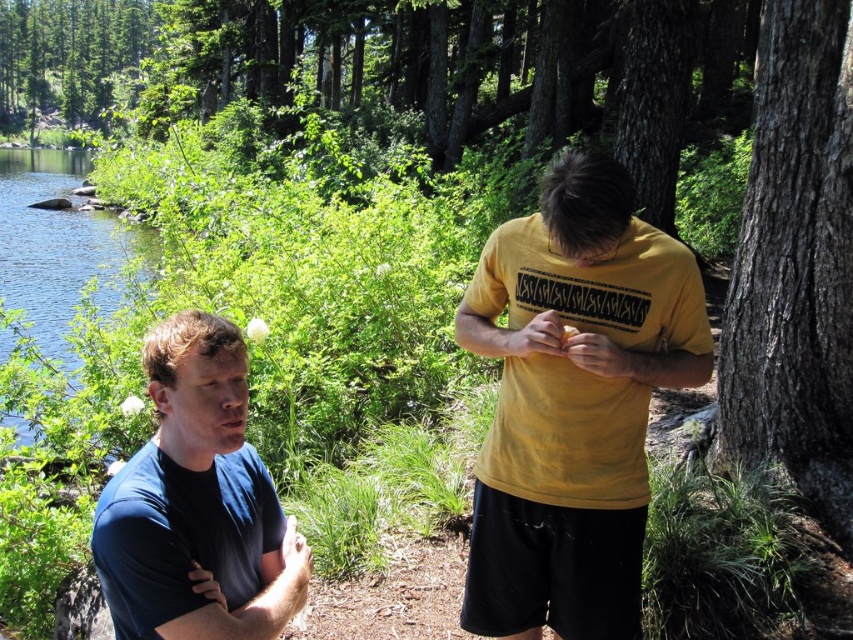
Between yellow matte shirt at right and smooth bark tree at right, which one is positioned lower?

yellow matte shirt at right is below.

Who is more distant from viewer, (552, 204) or (808, 298)?

Point (808, 298)

This screenshot has height=640, width=853. What are the coordinates of `yellow matte shirt at right` in the screenshot? It's located at [x=573, y=403].

Locate an element on the screen. This screenshot has height=640, width=853. yellow matte shirt at right is located at coordinates (573, 403).

Can you confirm if yellow matte shirt at right is positioned to the right of blue water at left?

Correct, you'll find yellow matte shirt at right to the right of blue water at left.

Based on the photo, which is below, yellow matte shirt at right or blue water at left?

yellow matte shirt at right

Which is in front, point (645, 483) or point (62, 337)?

Point (645, 483) is in front.

Find the location of a particular element. yellow matte shirt at right is located at coordinates (573, 403).

Can you confirm if yellow matte shirt at right is taller than blue cotton shirt at lower left?

Indeed, yellow matte shirt at right has a greater height compared to blue cotton shirt at lower left.

Does point (479, 616) come farther from viewer compared to point (199, 381)?

Yes, point (479, 616) is behind point (199, 381).

Find the location of a particular element. This screenshot has width=853, height=640. yellow matte shirt at right is located at coordinates (573, 403).